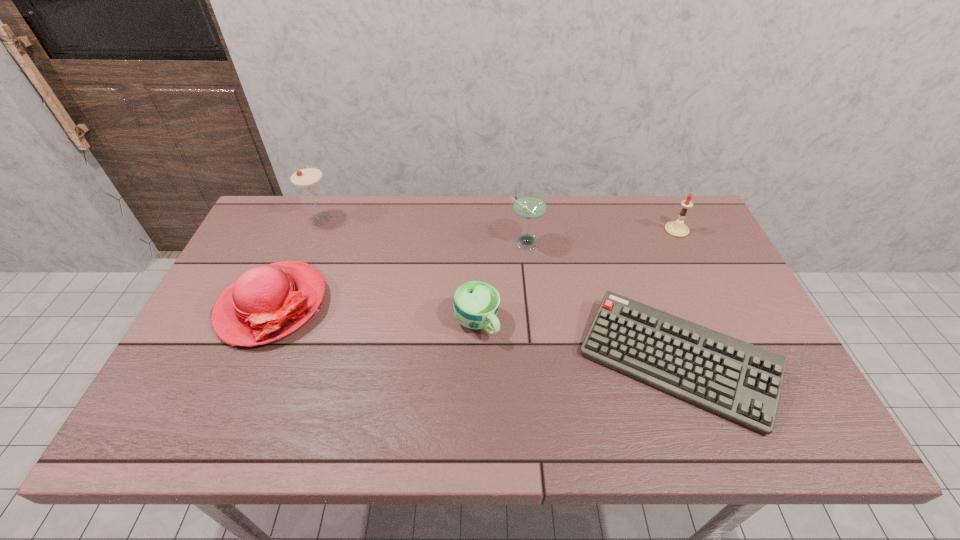
Find the location of a particular element. The image size is (960, 540). free space located 0.250m on the front of the candle is located at coordinates (708, 297).

Where is `free space located 0.190m at the front of the hat with a bow`? This screenshot has width=960, height=540. free space located 0.190m at the front of the hat with a bow is located at coordinates coord(222,424).

Find the location of a particular element. The image size is (960, 540). vacant region located on the left of the cup is located at coordinates (423, 322).

Find the location of a particular element. This screenshot has width=960, height=540. vacant space located 0.380m on the left of the shortest object is located at coordinates (424, 362).

The height and width of the screenshot is (540, 960). In order to click on candle present at the far edge in this screenshot , I will do `click(677, 228)`.

Locate an element on the screen. The image size is (960, 540). object located at the near edge is located at coordinates [x=740, y=381].

Where is `martini that is positioned at the left edge`? This screenshot has height=540, width=960. martini that is positioned at the left edge is located at coordinates (307, 178).

I want to click on hat that is at the left edge, so click(x=266, y=303).

Locate an element on the screen. This screenshot has width=960, height=540. candle that is at the right edge is located at coordinates (677, 228).

The image size is (960, 540). I want to click on computer keyboard that is at the right edge, so click(740, 381).